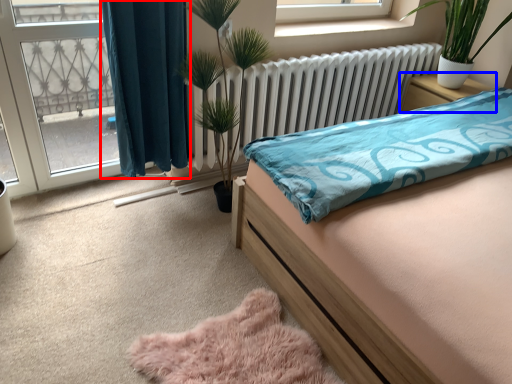
Question: Which object is closer to the camera taking this photo, curtain (highlighted by a red box) or nightstand (highlighted by a blue box)?

Choices:
 (A) curtain
 (B) nightstand

Answer: (A)